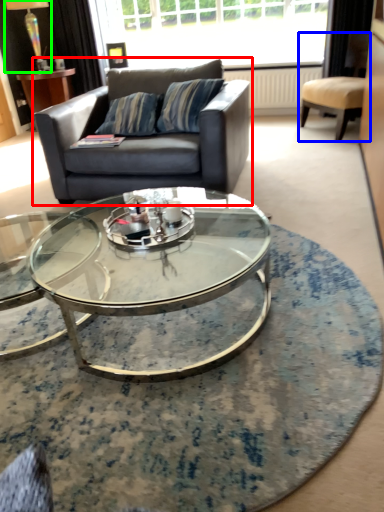
Question: Which object is positioned farthest from studio couch (highlighted by a red box)? Select from chair (highlighted by a blue box) and lamp (highlighted by a green box).

Choices:
 (A) chair
 (B) lamp

Answer: (B)